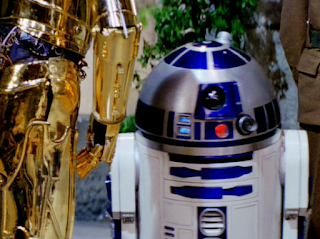
Locate an element on the screen. The width and height of the screenshot is (320, 239). hinge is located at coordinates (130, 220), (290, 214).